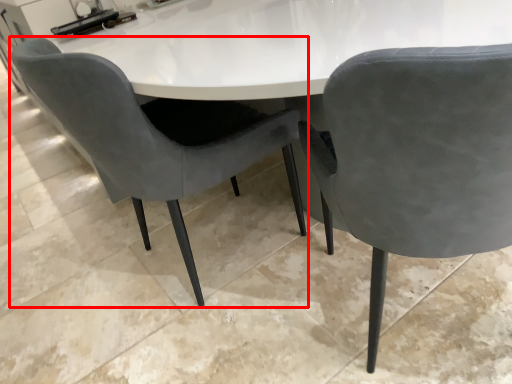
Question: Observing the image, what is the correct spatial positioning of chair (annotated by the red box) in reference to chair?

Choices:
 (A) right
 (B) left

Answer: (B)